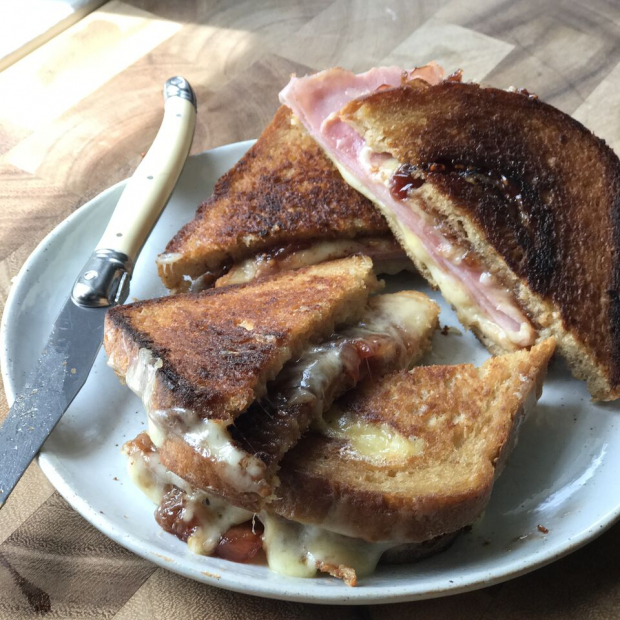
You are a GUI agent. You are given a task and a screenshot of the screen. Output one action in this format:
    pyautogui.click(x=<x>, y=<y>)
    Task: Click on the plate
    
    Given the screenshot: What is the action you would take?
    pyautogui.click(x=562, y=506)